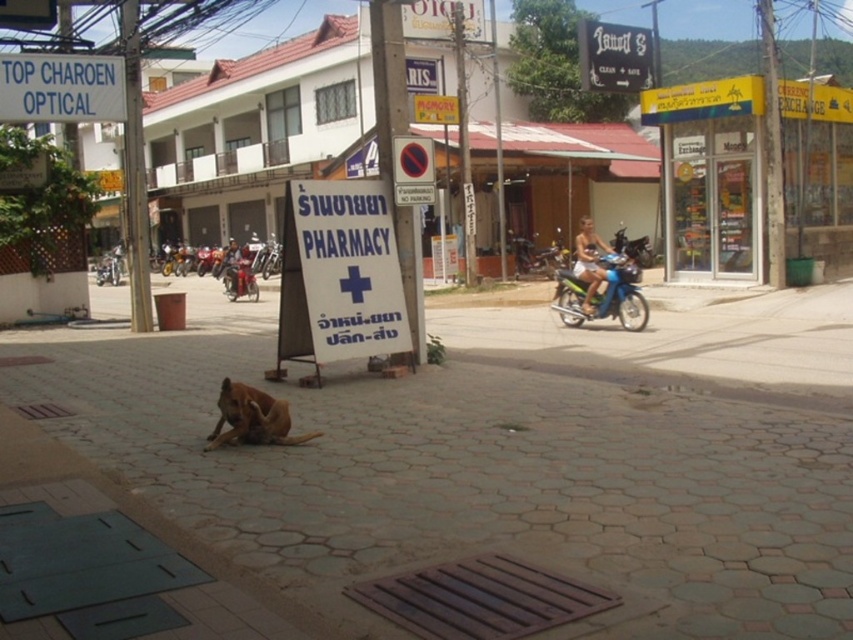
Who is positioned more to the left, brown stone pavement at center or black wood sign at upper center?

brown stone pavement at center is more to the left.

Is brown stone pavement at center shorter than black wood sign at upper center?

Correct, brown stone pavement at center is not as tall as black wood sign at upper center.

Is point (131, 445) positioned before point (651, 68)?

Yes.

You are a GUI agent. You are given a task and a screenshot of the screen. Output one action in this format:
    pyautogui.click(x=<x>, y=<y>)
    Task: Click on the brown stone pavement at center
    
    Given the screenshot: What is the action you would take?
    pyautogui.click(x=503, y=454)

Which of these two, black wood sign at upper center or reddish-brown leather jacket at center, stands taller?

black wood sign at upper center is taller.

The height and width of the screenshot is (640, 853). What are the coordinates of `black wood sign at upper center` in the screenshot? It's located at (614, 56).

Does point (610, 29) come behind point (225, 260)?

No, it is in front of (225, 260).

Image resolution: width=853 pixels, height=640 pixels. I want to click on black wood sign at upper center, so click(x=614, y=56).

Can you confirm if white plastic sign at center is taller than black wood sign at upper center?

No, white plastic sign at center is not taller than black wood sign at upper center.

The image size is (853, 640). What do you see at coordinates (392, 152) in the screenshot?
I see `white plastic sign at center` at bounding box center [392, 152].

Describe the element at coordinates (392, 152) in the screenshot. I see `white plastic sign at center` at that location.

Identify the location of white plastic sign at center. This screenshot has height=640, width=853. (392, 152).